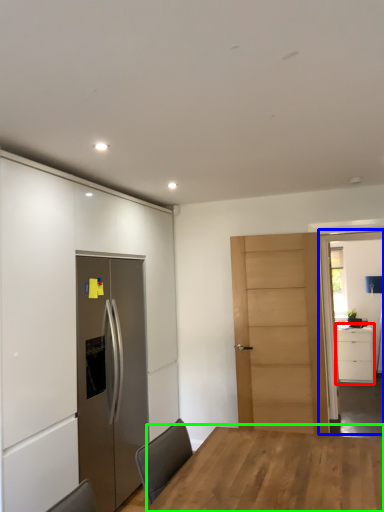
Question: Which object is the closest to the cabinetry (highlighted by a red box)? Choose among these: glass door (highlighted by a blue box) or table (highlighted by a green box).

Choices:
 (A) glass door
 (B) table

Answer: (A)